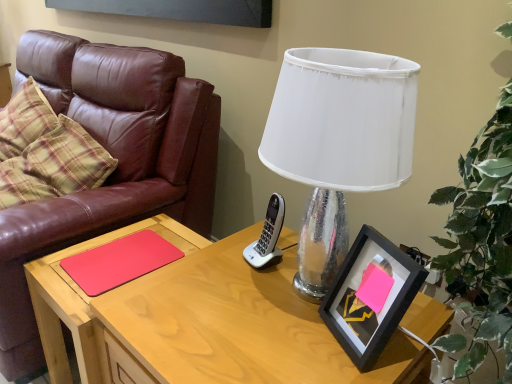
The image size is (512, 384). In order to click on free spot above wooden desk at center (from a real-world perspective) in this screenshot , I will do `click(247, 311)`.